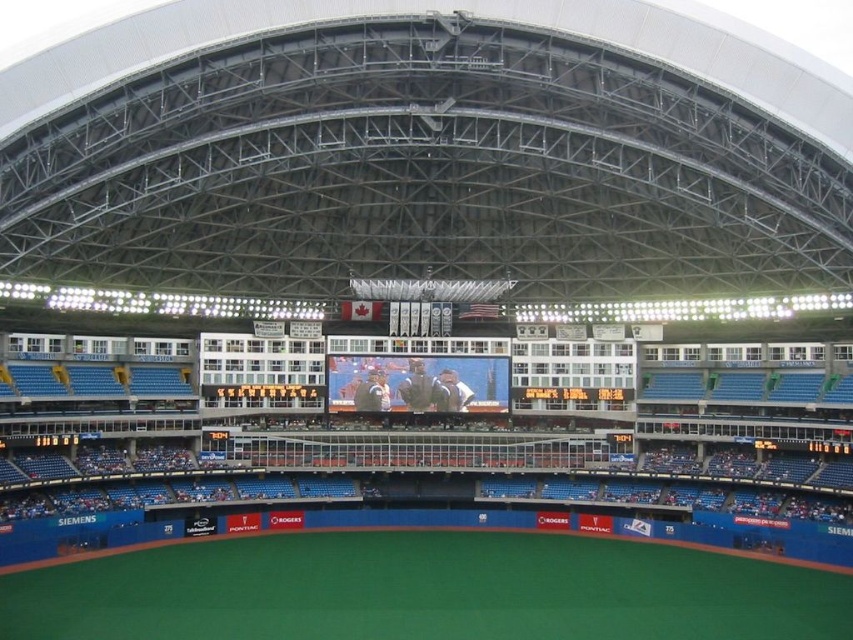
You are standing at the center of the field in the baseball stadium and looking towards the seating area. There are two points marked in the image at coordinates point (508, 404) and point (300, 388). Which of these two points is closer to your current position?

Point (300, 388) is closer to your current position because it is closer to the camera compared to point (508, 404), which is further away.

You are a spectator at the baseball game and want to check the live stats. You see both the matte digital screen at center and the black glossy scoreboard at center. Which one is bigger?

The matte digital screen at center has a larger size compared to the black glossy scoreboard at center, so the matte digital screen at center is bigger.

You are standing at the entrance of the stadium and want to find the matte digital screen at center. Based on the coordinates provided, where should you look relative to your current position?

The matte digital screen at center is located at coordinates point (416, 381), which is slightly to the right and directly ahead of your current position.